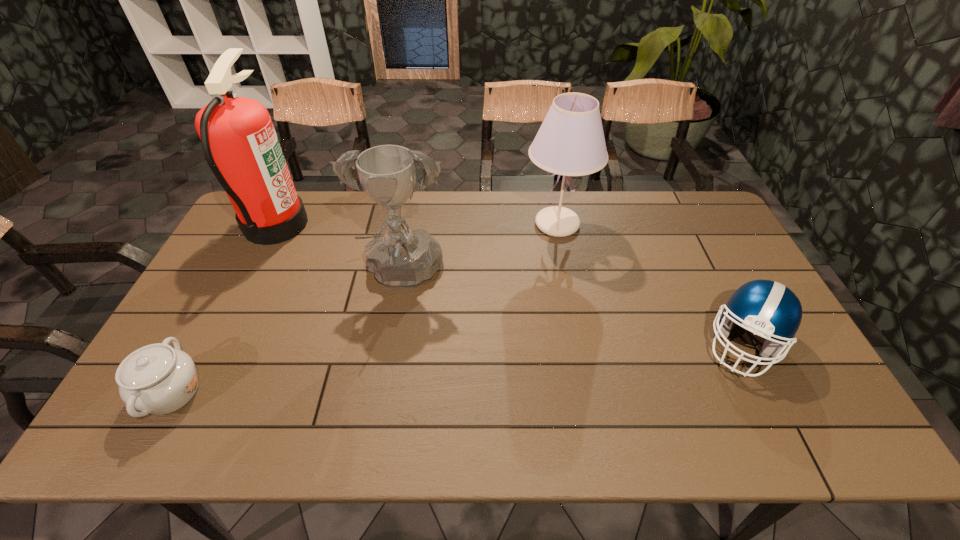
Locate an element on the screen. The width and height of the screenshot is (960, 540). blank space located on the back of the shortest object is located at coordinates (240, 265).

The height and width of the screenshot is (540, 960). Find the location of `fire extinguisher located at the far edge`. fire extinguisher located at the far edge is located at coordinates (238, 138).

You are a GUI agent. You are given a task and a screenshot of the screen. Output one action in this format:
    pyautogui.click(x=<x>, y=<y>)
    Task: Click on the lampshade that is positioned at the far edge
    
    Given the screenshot: What is the action you would take?
    pyautogui.click(x=570, y=142)

At what (x,y) coordinates should I click in order to perform the action: click on object at the near edge. Please return your answer as a coordinate pair (x, y). Looking at the image, I should click on (156, 379).

You are a GUI agent. You are given a task and a screenshot of the screen. Output one action in this format:
    pyautogui.click(x=<x>, y=<y>)
    Task: Click on the fire extinguisher positioned at the left edge
    This screenshot has height=540, width=960.
    Given the screenshot: What is the action you would take?
    pyautogui.click(x=238, y=138)

Image resolution: width=960 pixels, height=540 pixels. What are the coordinates of `chinaware at the left edge` in the screenshot? It's located at (156, 379).

The height and width of the screenshot is (540, 960). I want to click on object that is positioned at the right edge, so pos(766,308).

Where is `object that is at the far left corner`? object that is at the far left corner is located at coordinates 238,138.

Identify the location of object located in the near left corner section of the desktop. The image size is (960, 540). (156, 379).

Locate an element on the screen. This screenshot has width=960, height=540. vacant space at the far edge of the desktop is located at coordinates (531, 216).